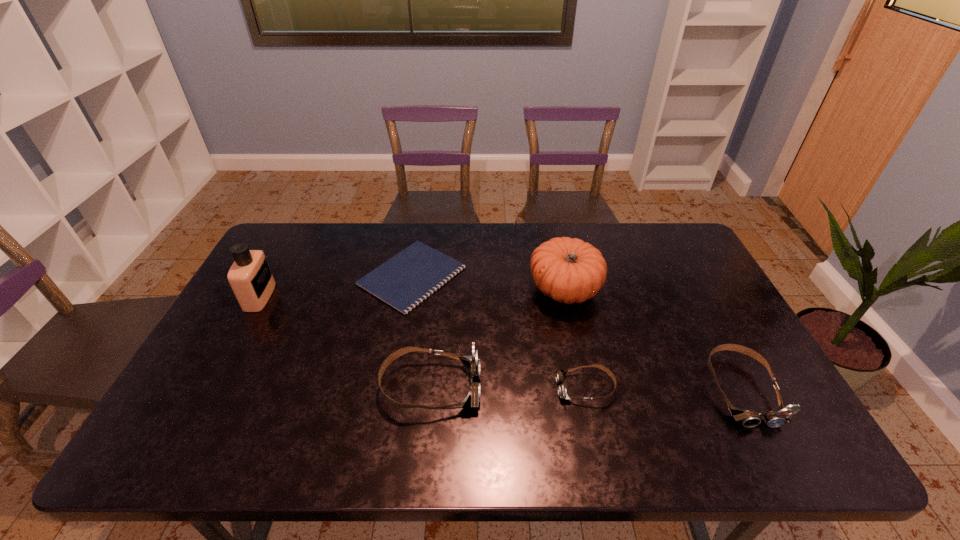
In the image, there is a desktop. Identify the location of vacant space at the far edge. This screenshot has width=960, height=540. (478, 222).

You are a GUI agent. You are given a task and a screenshot of the screen. Output one action in this format:
    pyautogui.click(x=<x>, y=<y>)
    Task: Click on the free space at the near edge of the desktop
    The height and width of the screenshot is (540, 960).
    Given the screenshot: What is the action you would take?
    pyautogui.click(x=325, y=414)

Locate an element on the screen. Image resolution: width=960 pixels, height=540 pixels. free space at the left edge of the desktop is located at coordinates (279, 307).

In the image, there is a desktop. At what (x,y) coordinates should I click in order to perform the action: click on vacant space at the right edge. Please return your answer as a coordinate pair (x, y). This screenshot has width=960, height=540. Looking at the image, I should click on [732, 356].

In order to click on free space at the far left corner of the desktop in this screenshot , I will do `click(320, 231)`.

At what (x,y) coordinates should I click in order to perform the action: click on free location at the near left corner. Please return your answer as a coordinate pair (x, y). Looking at the image, I should click on (224, 393).

The image size is (960, 540). I want to click on free point between the second goggles from right to left and the perfume, so click(x=422, y=342).

Find the location of `free space that is in between the second shortest object and the second tallest object`. free space that is in between the second shortest object and the second tallest object is located at coordinates (575, 339).

You are a GUI agent. You are given a task and a screenshot of the screen. Output one action in this format:
    pyautogui.click(x=<x>, y=<y>)
    Task: Click on the vacant space in between the notepad and the leftmost goggles
    
    Given the screenshot: What is the action you would take?
    pyautogui.click(x=421, y=331)

Identify the location of empty space between the rightmost object and the leftmost goggles. This screenshot has height=540, width=960. (586, 388).